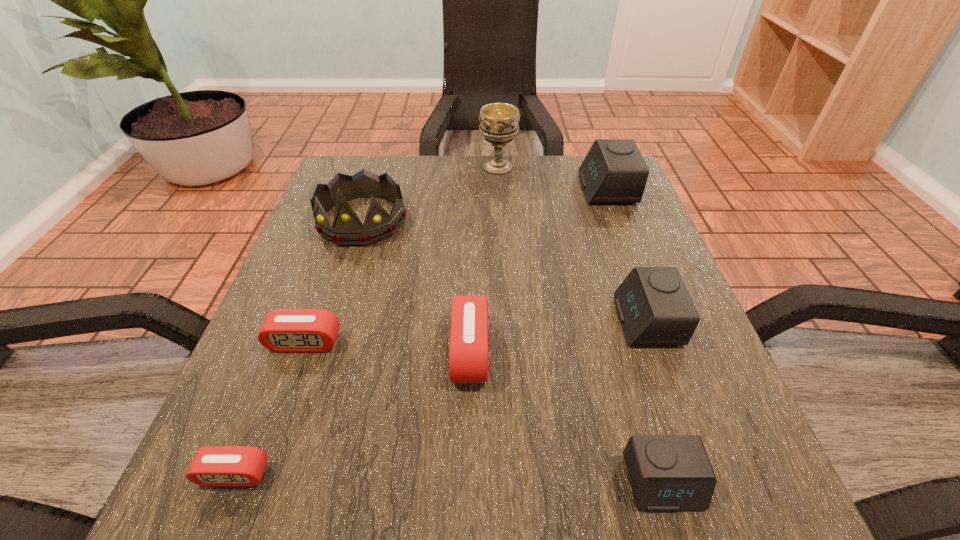
Identify the location of the shortest object. (211, 466).

The height and width of the screenshot is (540, 960). Identify the location of vacant space located on the front of the chalice. (501, 217).

This screenshot has height=540, width=960. In order to click on vacant space situated at the front of the tiara with jewels in this screenshot , I will do [x=301, y=409].

Locate an element on the screen. This screenshot has width=960, height=540. free location located 0.310m on the front-facing side of the third tallest object is located at coordinates (454, 188).

You are a GUI agent. You are given a task and a screenshot of the screen. Output one action in this format:
    pyautogui.click(x=<x>, y=<y>)
    Task: Click on the vacant point located on the front-facing side of the third tallest object
    
    Given the screenshot: What is the action you would take?
    pyautogui.click(x=462, y=188)

At what (x,y) coordinates should I click in order to perform the action: click on free spot located on the front-facing side of the third tallest object. Please return your answer as a coordinate pair (x, y). Looking at the image, I should click on (454, 188).

Identify the location of free space located on the front-facing side of the second farthest black alarm clock. The width and height of the screenshot is (960, 540). (573, 321).

You are a GUI agent. You are given a task and a screenshot of the screen. Output one action in this format:
    pyautogui.click(x=<x>, y=<y>)
    Task: Click on the vacant space located on the front-facing side of the second farthest black alarm clock
    Image resolution: width=960 pixels, height=540 pixels.
    Given the screenshot: What is the action you would take?
    pyautogui.click(x=516, y=321)

You are a GUI agent. You are given a task and a screenshot of the screen. Output one action in this format:
    pyautogui.click(x=<x>, y=<y>)
    Task: Click on the free space located on the front-facing side of the second farthest black alarm clock
    
    Given the screenshot: What is the action you would take?
    pyautogui.click(x=544, y=321)

The image size is (960, 540). I want to click on vacant point located 0.320m on the front-facing side of the fourth alarm clock from right to left, so click(x=684, y=352).